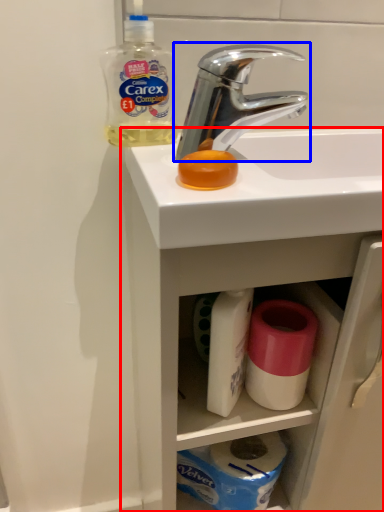
Question: Among these objects, which one is nearest to the camera, bathroom cabinet (highlighted by a red box) or tap (highlighted by a blue box)?

Choices:
 (A) bathroom cabinet
 (B) tap

Answer: (A)